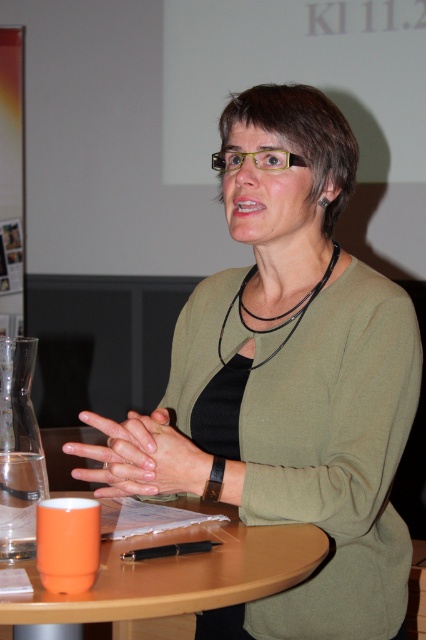
Which is more to the left, smooth skin hands at center or black leather necklace at center?

smooth skin hands at center

Can you confirm if smooth skin hands at center is bigger than black leather necklace at center?

Actually, smooth skin hands at center might be smaller than black leather necklace at center.

Describe the element at coordinates (141, 456) in the screenshot. I see `smooth skin hands at center` at that location.

Locate an element on the screen. This screenshot has height=640, width=426. smooth skin hands at center is located at coordinates (141, 456).

The image size is (426, 640). What do you see at coordinates (287, 380) in the screenshot? I see `matte green sweater at center` at bounding box center [287, 380].

Is matte green sweater at center thinner than orange matte cup at lower left?

Incorrect, matte green sweater at center's width is not less than orange matte cup at lower left's.

Measure the distance between matte green sweater at center and camera.

matte green sweater at center is 37.55 inches from camera.

What are the coordinates of `matte green sweater at center` in the screenshot? It's located at (287, 380).

Between orange matte cup at lower left and smooth skin hands at center, which one appears on the right side from the viewer's perspective?

Positioned to the right is orange matte cup at lower left.

Is point (131, 611) closer to viewer compared to point (164, 422)?

Yes, point (131, 611) is in front of point (164, 422).

Which is in front, point (235, 557) or point (78, 448)?

Point (235, 557) is in front.

This screenshot has width=426, height=640. Identify the location of orange matte cup at lower left. (175, 577).